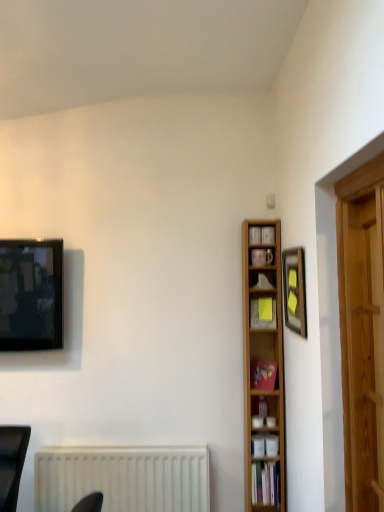
In order to face wooden framed picture at upper right, should I rotate leftwards or rightwards?

Turn right approximately 13.233 degrees to face it.

Measure the distance between point (249, 265) and camera.

Point (249, 265) and camera are 8.26 feet apart from each other.

Locate an element on the screen. The image size is (384, 512). wooden bookcase at right is located at coordinates (266, 364).

Describe the element at coordinates (31, 295) in the screenshot. This screenshot has height=512, width=384. I see `matte black television at upper left` at that location.

Describe the element at coordinates (258, 315) in the screenshot. The height and width of the screenshot is (512, 384). I see `matte yellow sticky note at center-right, which is the 1th book in top-to-bottom order` at that location.

What do you see at coordinates (263, 374) in the screenshot? I see `matte red book at center-right, marked as the second book in a top-to-bottom arrangement` at bounding box center [263, 374].

This screenshot has height=512, width=384. In order to click on hardcover book at lower center, arranged as the 3th book when viewed from the top in this screenshot , I will do `click(265, 484)`.

Can we say wooden bookcase at right lies outside matte yellow sticky note at center-right, which is the 1th book in top-to-bottom order?

Yes, wooden bookcase at right is outside of matte yellow sticky note at center-right, which is the 1th book in top-to-bottom order.

Is wooden bookcase at right far from matte yellow sticky note at center-right, which is the 1th book in top-to-bottom order?

No, wooden bookcase at right is in close proximity to matte yellow sticky note at center-right, which is the 1th book in top-to-bottom order.

Between wooden bookcase at right and matte yellow sticky note at center-right, which is the 1th book in top-to-bottom order, which one has less height?

matte yellow sticky note at center-right, which is the 1th book in top-to-bottom order.

Can you confirm if wooden bookcase at right is positioned to the left of matte yellow sticky note at center-right, arranged as the third book when ordered from the bottom?

Correct, you'll find wooden bookcase at right to the left of matte yellow sticky note at center-right, arranged as the third book when ordered from the bottom.

Would you say matte yellow sticky note at center-right, which is the 1th book in top-to-bottom order, is to the left or to the right of wooden bookcase at right in the picture?

Clearly, matte yellow sticky note at center-right, which is the 1th book in top-to-bottom order, is on the right of wooden bookcase at right in the image.

Considering the points (270, 323) and (249, 504), which point is in front, point (270, 323) or point (249, 504)?

The point (249, 504) is closer to the camera.

Is matte yellow sticky note at center-right, arranged as the third book when ordered from the bottom, positioned far away from wooden bookcase at right?

Actually, matte yellow sticky note at center-right, arranged as the third book when ordered from the bottom, and wooden bookcase at right are a little close together.

Measure the distance from matte yellow sticky note at center-right, which is the 1th book in top-to-bottom order, to wooden framed picture at upper right.

They are 13.00 inches apart.

The width and height of the screenshot is (384, 512). Identify the location of picture frame that appears above the matte yellow sticky note at center-right, arranged as the third book when ordered from the bottom (from a real-world perspective). (294, 290).

Which is correct: matte yellow sticky note at center-right, which is the 1th book in top-to-bottom order, is inside wooden framed picture at upper right, or outside of it?

matte yellow sticky note at center-right, which is the 1th book in top-to-bottom order, lies outside wooden framed picture at upper right.

Which is nearer, (261,471) or (300,332)?

The point (300,332) is closer to the camera.

From the image's perspective, which object appears higher, hardcover book at lower center, arranged as the 3th book when viewed from the top, or wooden framed picture at upper right?

From the image's view, wooden framed picture at upper right is above.

Considering their positions, is hardcover book at lower center, positioned as the first book in bottom-to-top order, located in front of or behind wooden framed picture at upper right?

Visually, hardcover book at lower center, positioned as the first book in bottom-to-top order, is located behind wooden framed picture at upper right.

Is hardcover book at lower center, positioned as the first book in bottom-to-top order, oriented towards wooden framed picture at upper right?

No, hardcover book at lower center, positioned as the first book in bottom-to-top order, is not facing towards wooden framed picture at upper right.

From the image's perspective, count 3rd books downward from the matte black television at upper left and point to it. Please provide its 2D coordinates.

[(265, 484)]

From a real-world perspective, is hardcover book at lower center, positioned as the first book in bottom-to-top order, above or below matte black television at upper left?

From a real-world perspective, hardcover book at lower center, positioned as the first book in bottom-to-top order, is physically below matte black television at upper left.

Considering the relative positions of hardcover book at lower center, arranged as the 3th book when viewed from the top, and matte black television at upper left in the image provided, is hardcover book at lower center, arranged as the 3th book when viewed from the top, to the left or to the right of matte black television at upper left?

Clearly, hardcover book at lower center, arranged as the 3th book when viewed from the top, is on the right of matte black television at upper left in the image.

Which of these two, hardcover book at lower center, arranged as the 3th book when viewed from the top, or matte black television at upper left, is thinner?

With smaller width is hardcover book at lower center, arranged as the 3th book when viewed from the top.

Is hardcover book at lower center, positioned as the first book in bottom-to-top order, positioned beyond the bounds of matte red book at center-right, the 2th book from the bottom?

Yes.

Based on the photo, could you tell me if hardcover book at lower center, positioned as the first book in bottom-to-top order, is facing matte red book at center-right, the 2th book from the bottom?

No, hardcover book at lower center, positioned as the first book in bottom-to-top order, does not turn towards matte red book at center-right, the 2th book from the bottom.

Is hardcover book at lower center, positioned as the first book in bottom-to-top order, directly adjacent to matte red book at center-right, marked as the second book in a top-to-bottom arrangement?

No, hardcover book at lower center, positioned as the first book in bottom-to-top order, is not touching matte red book at center-right, marked as the second book in a top-to-bottom arrangement.

Find the location of `book below the matte red book at center-right, marked as the second book in a top-to-bottom arrangement (from a real-world perspective)`. book below the matte red book at center-right, marked as the second book in a top-to-bottom arrangement (from a real-world perspective) is located at coordinates (265, 484).

How much distance is there between matte red book at center-right, the 2th book from the bottom, and matte yellow sticky note at center-right, arranged as the third book when ordered from the bottom?

matte red book at center-right, the 2th book from the bottom, and matte yellow sticky note at center-right, arranged as the third book when ordered from the bottom, are 10.32 inches apart from each other.

From the image's perspective, count 1st books downward from the matte yellow sticky note at center-right, which is the 1th book in top-to-bottom order, and point to it. Please provide its 2D coordinates.

[(263, 374)]

Which is more to the left, matte red book at center-right, the 2th book from the bottom, or matte yellow sticky note at center-right, arranged as the third book when ordered from the bottom?

matte red book at center-right, the 2th book from the bottom.

From a real-world perspective, is matte red book at center-right, the 2th book from the bottom, located beneath matte yellow sticky note at center-right, which is the 1th book in top-to-bottom order?

Yes, from a real-world perspective, matte red book at center-right, the 2th book from the bottom, is below matte yellow sticky note at center-right, which is the 1th book in top-to-bottom order.

At what (x,y) coordinates should I click in order to perform the action: click on the 3rd book to the right of the wooden bookcase at right, starting your count from the anchor. Please return your answer as a coordinate pair (x, y). Looking at the image, I should click on (258, 315).

In order to click on the 2nd book behind the wooden bookcase at right in this screenshot , I will do `click(258, 315)`.

In the scene shown: From the image, which object appears to be farther from wooden framed picture at upper right, matte yellow sticky note at center-right, arranged as the third book when ordered from the bottom, or hardcover book at lower center, arranged as the 3th book when viewed from the top?

hardcover book at lower center, arranged as the 3th book when viewed from the top.

Which object lies further to the anchor point matte red book at center-right, marked as the second book in a top-to-bottom arrangement, wooden framed picture at upper right or hardcover book at lower center, positioned as the first book in bottom-to-top order?

wooden framed picture at upper right is further to matte red book at center-right, marked as the second book in a top-to-bottom arrangement.

Based on the photo, based on their spatial positions, is matte red book at center-right, the 2th book from the bottom, or matte black television at upper left closer to hardcover book at lower center, positioned as the first book in bottom-to-top order?

The object closer to hardcover book at lower center, positioned as the first book in bottom-to-top order, is matte red book at center-right, the 2th book from the bottom.

From the image, which object appears to be nearer to matte yellow sticky note at center-right, arranged as the third book when ordered from the bottom, matte red book at center-right, the 2th book from the bottom, or hardcover book at lower center, positioned as the first book in bottom-to-top order?

matte red book at center-right, the 2th book from the bottom.

Which object lies further to the anchor point hardcover book at lower center, arranged as the 3th book when viewed from the top, matte yellow sticky note at center-right, arranged as the third book when ordered from the bottom, or matte red book at center-right, marked as the second book in a top-to-bottom arrangement?

The object further to hardcover book at lower center, arranged as the 3th book when viewed from the top, is matte yellow sticky note at center-right, arranged as the third book when ordered from the bottom.

Considering their positions, is wooden bookcase at right positioned further to hardcover book at lower center, arranged as the 3th book when viewed from the top, than wooden framed picture at upper right?

Based on the image, wooden framed picture at upper right appears to be further to hardcover book at lower center, arranged as the 3th book when viewed from the top.

Considering their positions, is matte black television at upper left positioned closer to matte yellow sticky note at center-right, which is the 1th book in top-to-bottom order, than wooden framed picture at upper right?

wooden framed picture at upper right.

From the image, which object appears to be nearer to matte red book at center-right, the 2th book from the bottom, matte black television at upper left or matte yellow sticky note at center-right, which is the 1th book in top-to-bottom order?

matte yellow sticky note at center-right, which is the 1th book in top-to-bottom order, is positioned closer to the anchor matte red book at center-right, the 2th book from the bottom.

Where is `bookcase between matte yellow sticky note at center-right, arranged as the third book when ordered from the bottom, and hardcover book at lower center, arranged as the 3th book when viewed from the top, in the vertical direction`? The image size is (384, 512). bookcase between matte yellow sticky note at center-right, arranged as the third book when ordered from the bottom, and hardcover book at lower center, arranged as the 3th book when viewed from the top, in the vertical direction is located at coordinates (266, 364).

I want to click on bookcase between matte black television at upper left and wooden framed picture at upper right, so click(266, 364).

Identify the location of bookcase positioned between wooden framed picture at upper right and matte yellow sticky note at center-right, arranged as the third book when ordered from the bottom, from near to far. (266, 364).

The image size is (384, 512). I want to click on book between wooden bookcase at right and hardcover book at lower center, positioned as the first book in bottom-to-top order, from top to bottom, so click(263, 374).